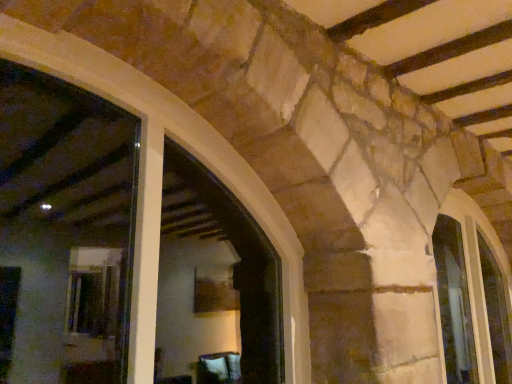
At what (x,y) coordinates should I click in order to perform the action: click on clear glass window at center-right, the 1th window viewed from the left. Please return your answer as a coordinate pair (x, y). The height and width of the screenshot is (384, 512). Looking at the image, I should click on (454, 303).

Based on the photo, measure the distance between point (456,236) and camera.

Point (456,236) is 4.05 meters away from camera.

Describe the element at coordinates (454, 303) in the screenshot. Image resolution: width=512 pixels, height=384 pixels. I see `clear glass window at center-right, the 2th window when ordered from right to left` at that location.

I want to click on clear glass window at right, positioned as the 2th window in left-to-right order, so click(x=496, y=313).

How much space does clear glass window at right, positioned as the 2th window in left-to-right order, occupy horizontally?

It is 3.80 inches.

What do you see at coordinates (496, 313) in the screenshot? I see `clear glass window at right, positioned as the 2th window in left-to-right order` at bounding box center [496, 313].

Where is `clear glass window at center-right, the 2th window when ordered from right to left`? The width and height of the screenshot is (512, 384). clear glass window at center-right, the 2th window when ordered from right to left is located at coordinates (454, 303).

Is clear glass window at right, arranged as the first window when viewed from the right, to the right of clear glass window at center-right, the 1th window viewed from the left, from the viewer's perspective?

Yes, clear glass window at right, arranged as the first window when viewed from the right, is to the right of clear glass window at center-right, the 1th window viewed from the left.

Based on the photo, relative to clear glass window at center-right, the 1th window viewed from the left, is clear glass window at right, arranged as the first window when viewed from the right, in front or behind?

clear glass window at right, arranged as the first window when viewed from the right, is behind clear glass window at center-right, the 1th window viewed from the left.

Does point (494, 299) lie behind point (469, 329)?

That is True.

From the image's perspective, is clear glass window at right, arranged as the first window when viewed from the right, located above clear glass window at center-right, the 1th window viewed from the left?

No, from the image's perspective, clear glass window at right, arranged as the first window when viewed from the right, is not over clear glass window at center-right, the 1th window viewed from the left.

From a real-world perspective, is clear glass window at right, arranged as the first window when viewed from the right, above or below clear glass window at center-right, the 1th window viewed from the left?

clear glass window at right, arranged as the first window when viewed from the right, is situated lower than clear glass window at center-right, the 1th window viewed from the left, in the real world.

Consider the image. In terms of width, does clear glass window at right, arranged as the first window when viewed from the right, look wider or thinner when compared to clear glass window at center-right, the 2th window when ordered from right to left?

In the image, clear glass window at right, arranged as the first window when viewed from the right, appears to be wider than clear glass window at center-right, the 2th window when ordered from right to left.

Which of these two, clear glass window at right, positioned as the 2th window in left-to-right order, or clear glass window at center-right, the 2th window when ordered from right to left, stands shorter?

With less height is clear glass window at right, positioned as the 2th window in left-to-right order.

Is clear glass window at right, positioned as the 2th window in left-to-right order, bigger or smaller than clear glass window at center-right, the 1th window viewed from the left?

Clearly, clear glass window at right, positioned as the 2th window in left-to-right order, is smaller in size than clear glass window at center-right, the 1th window viewed from the left.

Is clear glass window at right, positioned as the 2th window in left-to-right order, not inside clear glass window at center-right, the 2th window when ordered from right to left?

Absolutely, clear glass window at right, positioned as the 2th window in left-to-right order, is external to clear glass window at center-right, the 2th window when ordered from right to left.

Is there a large distance between clear glass window at right, arranged as the first window when viewed from the right, and clear glass window at center-right, the 2th window when ordered from right to left?

clear glass window at right, arranged as the first window when viewed from the right, is near clear glass window at center-right, the 2th window when ordered from right to left, not far away.

Is clear glass window at right, arranged as the first window when viewed from the right, oriented away from clear glass window at center-right, the 2th window when ordered from right to left?

No.

Can you tell me how much clear glass window at right, arranged as the first window when viewed from the right, and clear glass window at center-right, the 1th window viewed from the left, differ in facing direction?

The angle between the facing direction of clear glass window at right, arranged as the first window when viewed from the right, and the facing direction of clear glass window at center-right, the 1th window viewed from the left, is 0.00117 degrees.

Find the location of a particular element. window on the right side of clear glass window at center-right, the 1th window viewed from the left is located at coordinates (496, 313).

Visually, is clear glass window at center-right, the 2th window when ordered from right to left, positioned to the left or to the right of clear glass window at right, arranged as the first window when viewed from the right?

Clearly, clear glass window at center-right, the 2th window when ordered from right to left, is on the left of clear glass window at right, arranged as the first window when viewed from the right, in the image.

Which object is closer to the camera taking this photo, clear glass window at center-right, the 2th window when ordered from right to left, or clear glass window at right, positioned as the 2th window in left-to-right order?

clear glass window at center-right, the 2th window when ordered from right to left, is closer to the camera.

Between point (476, 376) and point (478, 237), which one is positioned in front?

The point (476, 376) is more forward.

From the image's perspective, between clear glass window at center-right, the 1th window viewed from the left, and clear glass window at right, arranged as the first window when viewed from the right, which one is located above?

clear glass window at center-right, the 1th window viewed from the left.

From a real-world perspective, is clear glass window at center-right, the 1th window viewed from the left, under clear glass window at right, arranged as the first window when viewed from the right?

No.

Which object is thinner, clear glass window at center-right, the 1th window viewed from the left, or clear glass window at right, positioned as the 2th window in left-to-right order?

With smaller width is clear glass window at center-right, the 1th window viewed from the left.

Is clear glass window at center-right, the 2th window when ordered from right to left, taller or shorter than clear glass window at right, positioned as the 2th window in left-to-right order?

clear glass window at center-right, the 2th window when ordered from right to left, is taller than clear glass window at right, positioned as the 2th window in left-to-right order.

Between clear glass window at center-right, the 2th window when ordered from right to left, and clear glass window at right, arranged as the first window when viewed from the right, which one has larger size?

Bigger between the two is clear glass window at center-right, the 2th window when ordered from right to left.

Which is correct: clear glass window at center-right, the 1th window viewed from the left, is inside clear glass window at right, positioned as the 2th window in left-to-right order, or outside of it?

The correct answer is: outside.

Is the surface of clear glass window at center-right, the 2th window when ordered from right to left, in direct contact with clear glass window at right, positioned as the 2th window in left-to-right order?

There is a gap between clear glass window at center-right, the 2th window when ordered from right to left, and clear glass window at right, positioned as the 2th window in left-to-right order.

Could you tell me if clear glass window at center-right, the 1th window viewed from the left, is turned towards clear glass window at right, positioned as the 2th window in left-to-right order?

No, clear glass window at center-right, the 1th window viewed from the left, is not turned towards clear glass window at right, positioned as the 2th window in left-to-right order.

How far apart are clear glass window at center-right, the 2th window when ordered from right to left, and clear glass window at right, positioned as the 2th window in left-to-right order?

35.40 centimeters.

Where is `window directly beneath the clear glass window at center-right, the 1th window viewed from the left (from a real-world perspective)`? The height and width of the screenshot is (384, 512). window directly beneath the clear glass window at center-right, the 1th window viewed from the left (from a real-world perspective) is located at coordinates (496, 313).

You are a GUI agent. You are given a task and a screenshot of the screen. Output one action in this format:
    pyautogui.click(x=<x>, y=<y>)
    Task: Click on the window directly beneath the clear glass window at center-right, the 1th window viewed from the left (from a real-world perspective)
    This screenshot has height=384, width=512.
    Given the screenshot: What is the action you would take?
    [496, 313]

The image size is (512, 384). In the image, there is a clear glass window at center-right, the 2th window when ordered from right to left. Find the location of `window below it (from the image's perspective)`. window below it (from the image's perspective) is located at coordinates (496, 313).